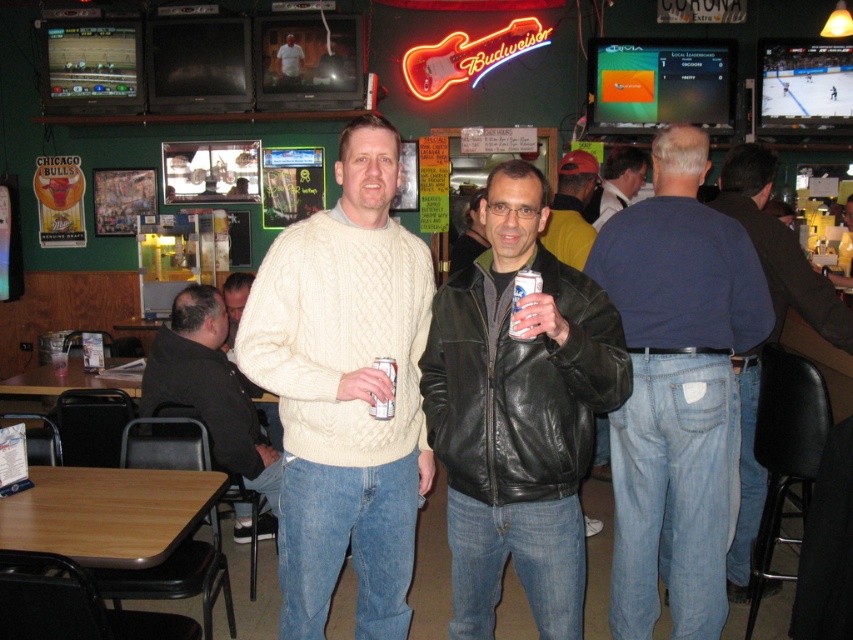
Is white cable-knit sweater at center thinner than jeans at center?

In fact, white cable-knit sweater at center might be wider than jeans at center.

Is white cable-knit sweater at center smaller than jeans at center?

Indeed, white cable-knit sweater at center has a smaller size compared to jeans at center.

What are the coordinates of `white cable-knit sweater at center` in the screenshot? It's located at (345, 390).

Can you confirm if blue cotton shirt at back is taller than black leather jacket at left?

Indeed, blue cotton shirt at back has a greater height compared to black leather jacket at left.

Who is taller, blue cotton shirt at back or black leather jacket at left?

blue cotton shirt at back

The height and width of the screenshot is (640, 853). I want to click on blue cotton shirt at back, so click(677, 388).

The image size is (853, 640). I want to click on blue cotton shirt at back, so click(x=677, y=388).

Is matte black jacket at center to the right of leather jacket at center from the viewer's perspective?

Yes, matte black jacket at center is to the right of leather jacket at center.

Is point (596, 227) positioned behind point (473, 208)?

Yes, it is behind point (473, 208).

Who is more distant from viewer, (628, 163) or (473, 240)?

The point (628, 163) is more distant.

The height and width of the screenshot is (640, 853). In order to click on matte black jacket at center in this screenshot , I will do `click(618, 182)`.